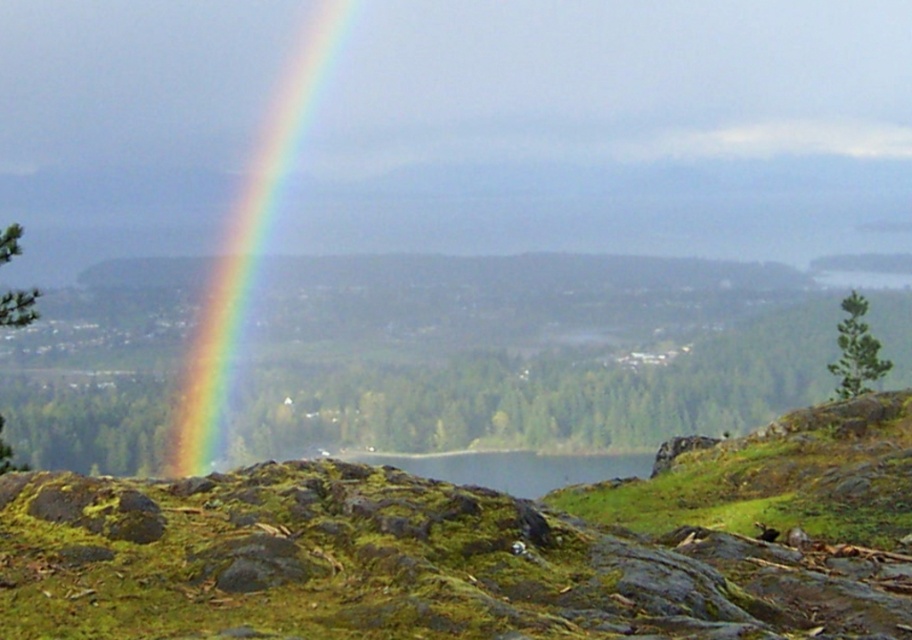
Does rainbow at left appear under green mossy rock at center?

No, rainbow at left is not below green mossy rock at center.

Does rainbow at left appear over green mossy rock at center?

Yes.

Image resolution: width=912 pixels, height=640 pixels. What do you see at coordinates (246, 243) in the screenshot?
I see `rainbow at left` at bounding box center [246, 243].

This screenshot has height=640, width=912. What are the coordinates of `rainbow at left` in the screenshot? It's located at (246, 243).